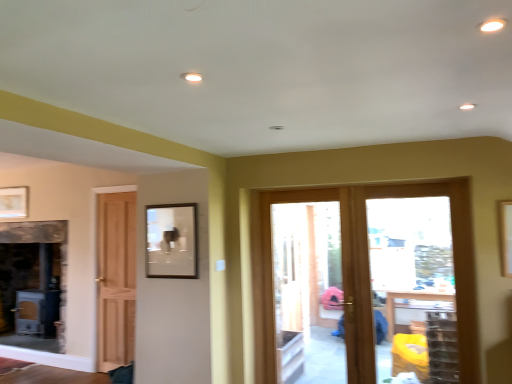
Question: Are clear glass door at center and matte brown picture frame at upper center, the second picture frame when ordered from back to front, located far from each other?

Choices:
 (A) yes
 (B) no

Answer: (A)

Question: Could you tell me if clear glass door at center is turned towards matte brown picture frame at upper center, the second picture frame when ordered from back to front?

Choices:
 (A) yes
 (B) no

Answer: (B)

Question: Considering the relative sizes of clear glass door at center and matte brown picture frame at upper center, which appears as the 2th picture frame when viewed from the left, in the image provided, is clear glass door at center shorter than matte brown picture frame at upper center, which appears as the 2th picture frame when viewed from the left,?

Choices:
 (A) no
 (B) yes

Answer: (A)

Question: From a real-world perspective, is clear glass door at center on top of matte brown picture frame at upper center, the second picture frame when ordered from back to front?

Choices:
 (A) no
 (B) yes

Answer: (A)

Question: Considering the relative positions of clear glass door at center and matte brown picture frame at upper center, the second picture frame when ordered from back to front, in the image provided, is clear glass door at center in front of matte brown picture frame at upper center, the second picture frame when ordered from back to front,?

Choices:
 (A) no
 (B) yes

Answer: (A)

Question: Is clear glass door at center positioned with its back to matte brown picture frame at upper center, the second picture frame when ordered from back to front?

Choices:
 (A) no
 (B) yes

Answer: (A)

Question: Is matte gold picture frame at upper left, the second picture frame viewed from the front, positioned far away from clear glass door at center?

Choices:
 (A) no
 (B) yes

Answer: (B)

Question: Is matte gold picture frame at upper left, the second picture frame viewed from the front, shorter than clear glass door at center?

Choices:
 (A) yes
 (B) no

Answer: (A)

Question: Can you confirm if matte gold picture frame at upper left, the second picture frame viewed from the front, is wider than clear glass door at center?

Choices:
 (A) no
 (B) yes

Answer: (A)

Question: From a real-world perspective, does matte gold picture frame at upper left, the second picture frame viewed from the front, stand above clear glass door at center?

Choices:
 (A) no
 (B) yes

Answer: (B)

Question: From a real-world perspective, is matte gold picture frame at upper left, marked as the first picture frame in a left-to-right arrangement, positioned under clear glass door at center based on gravity?

Choices:
 (A) no
 (B) yes

Answer: (A)

Question: Considering the relative positions of matte gold picture frame at upper left, the second picture frame positioned from the right, and clear glass door at center in the image provided, is matte gold picture frame at upper left, the second picture frame positioned from the right, to the right of clear glass door at center from the viewer's perspective?

Choices:
 (A) no
 (B) yes

Answer: (A)

Question: Can you confirm if clear glass door at center is smaller than wooden door at center?

Choices:
 (A) no
 (B) yes

Answer: (B)